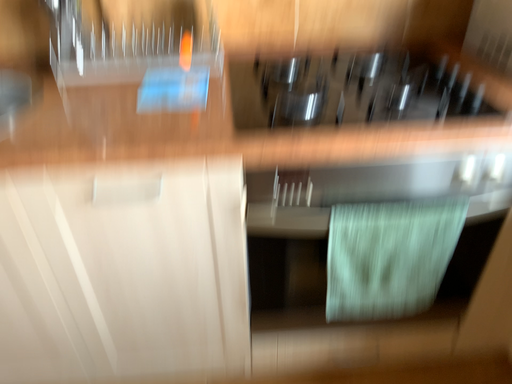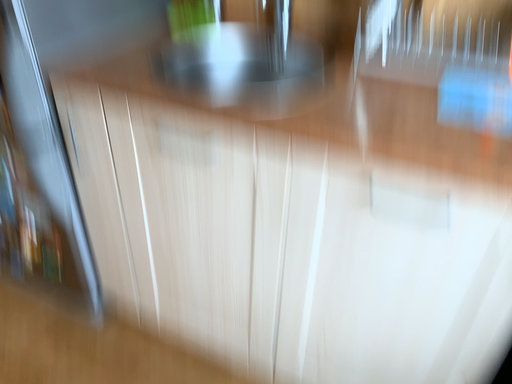
Question: Which way did the camera rotate in the video?

Choices:
 (A) rotated right
 (B) rotated left

Answer: (B)